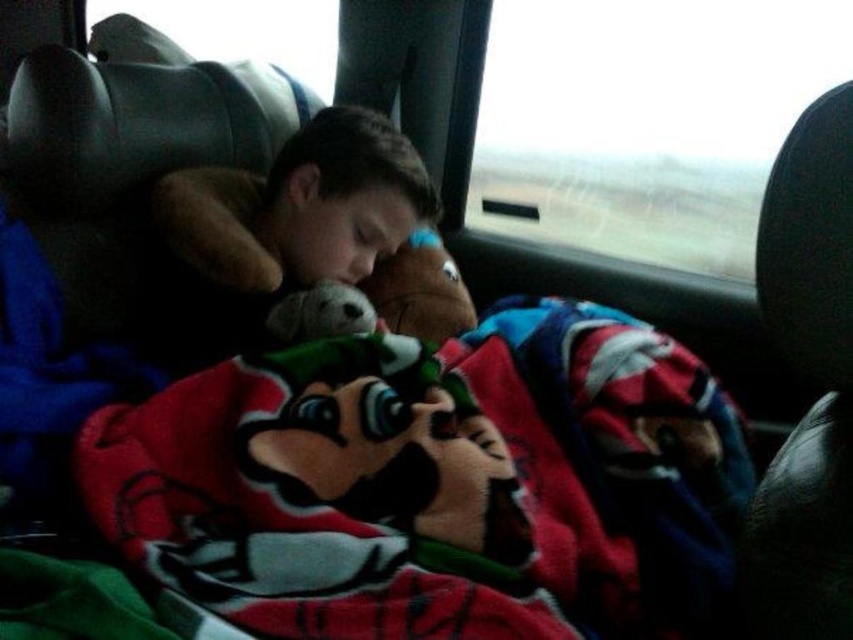
You are inside the vehicle shown in the image. You need to determine which of the two points, point [367,634] or point [360,124], is closer to you. Which one is closer?

Point [367,634] is closer to the viewer than point [360,124], so the closer point is point [367,634].

You are a passenger in a vehicle and want to use the red fleece blanket at center to cover yourself while keeping the soft plush toy at center close. Is the blanket placed in a way that allows you to do this?

The red fleece blanket at center is positioned under the soft plush toy at center, so you can lift the plush toy and use the blanket to cover yourself while still keeping the toy nearby.